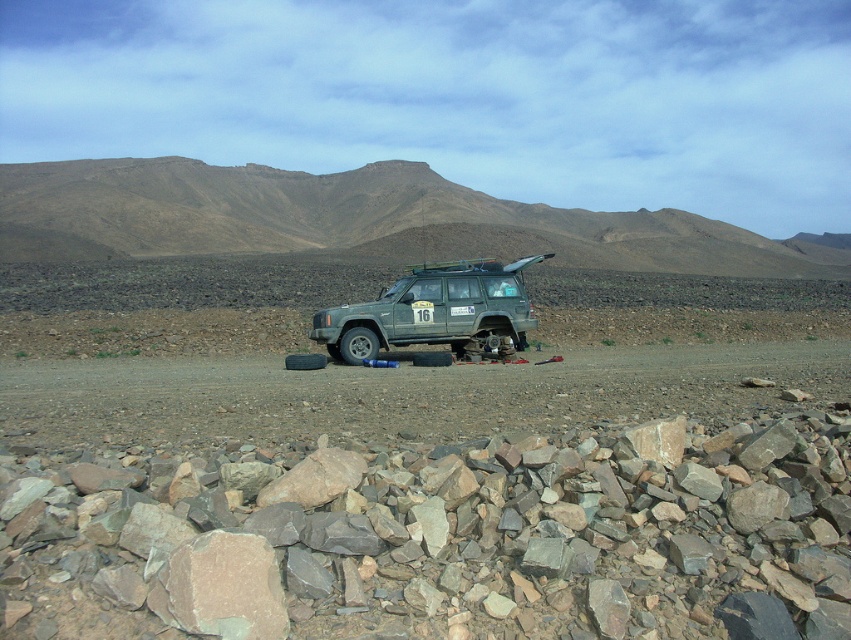
You are a hiker planning to climb the brown rocky mountain at upper center. You see the rusty stone pile at center in your path. Which direction should you go to avoid the stones?

To avoid the rusty stone pile at center, you should head upwards towards the brown rocky mountain at upper center since the stone pile is located below it.

You are navigating through the desert and need to reach a destination. You have two markers, point A at coordinates point (546, 234) and point B at coordinates point (490, 280). Which point is closer to your current position?

Point A at coordinates point (546, 234) is closer to your current position because it is further to the viewer than point B at coordinates point (490, 280).